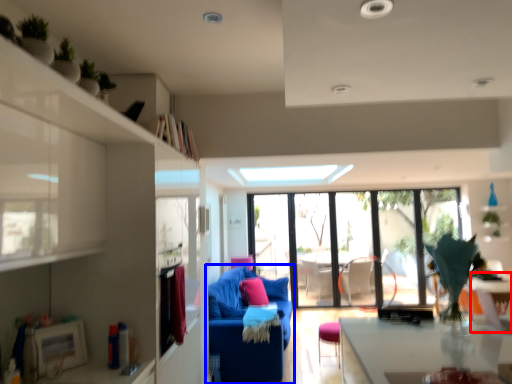
Question: Which object is further to the camera taking this photo, table (highlighted by a red box) or studio couch (highlighted by a blue box)?

Choices:
 (A) table
 (B) studio couch

Answer: (B)